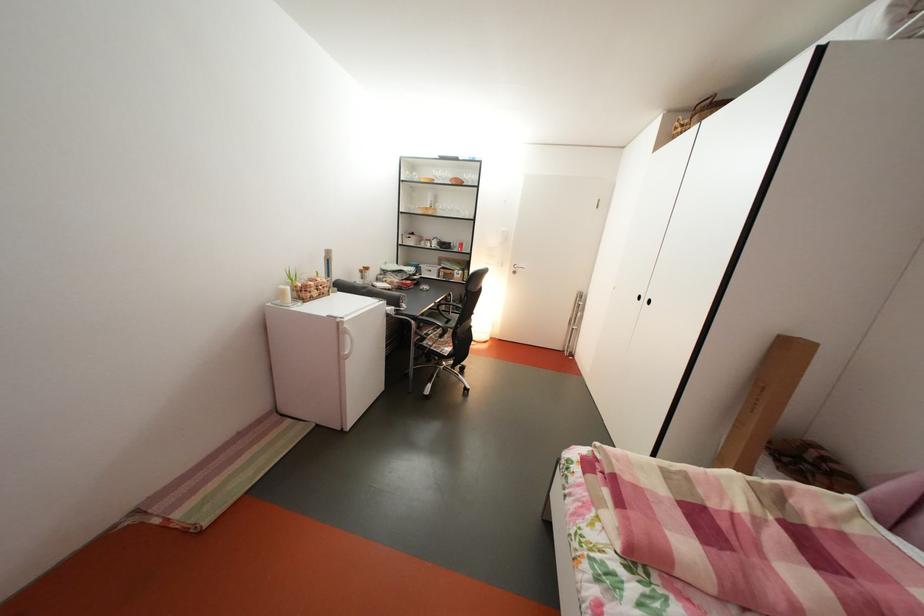
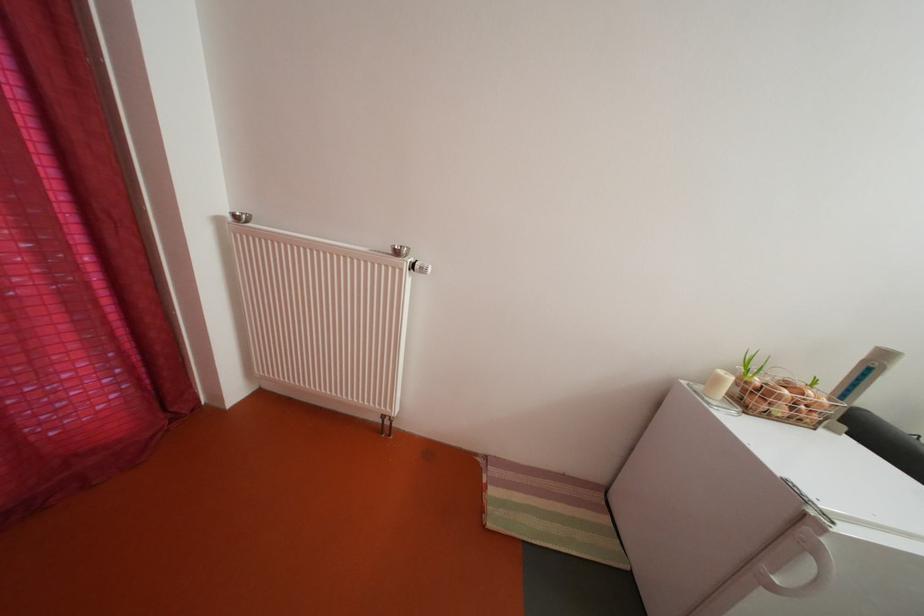
Find the pixel in the second image that matches point (326, 300) in the first image.

(792, 416)